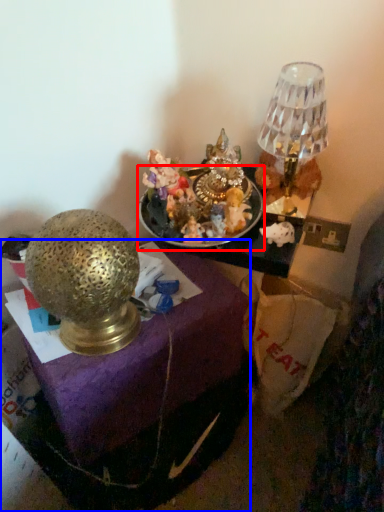
Question: Among these objects, which one is farthest to the camera, tableware (highlighted by a red box) or furniture (highlighted by a blue box)?

Choices:
 (A) tableware
 (B) furniture

Answer: (A)